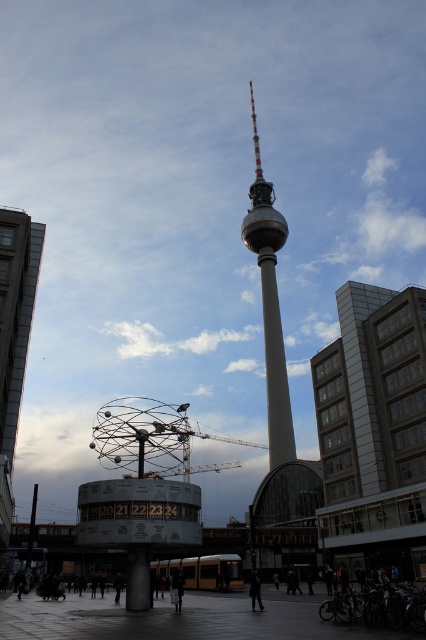
You are standing at the Berliner Fernsehturm and looking down at the point marked as point (x=255, y=589). What is the closest object to this point?

The closest object to point (x=255, y=589) is the black coat at lower center, as the point is located on it.

You are a tourist standing in front of the Berliner Fernsehturm and see a metallic pole at lower left and a black coat at lower center. Which object is positioned more to the left?

The metallic pole at lower left is positioned more to the left than the black coat at lower center.

You are standing in the urban scene and want to take a photo of the smooth gray tower at center without the gray concrete building at right blocking the view. Is this possible?

The gray concrete building at right is closer to the viewer than the smooth gray tower at center, so it will block the view of the tower. You need to move to a position where the building is not in front of the tower.